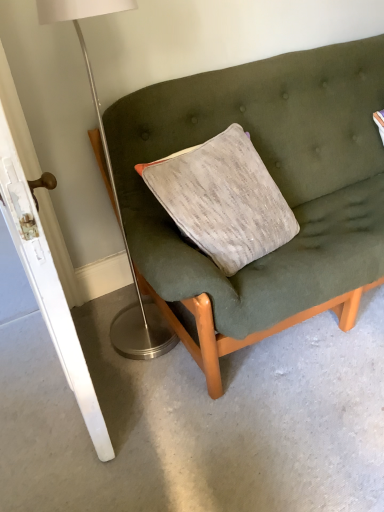
Question: From the image's perspective, is metallic silver floor lamp at left positioned above or below white glossy door at left?

Choices:
 (A) above
 (B) below

Answer: (A)

Question: In the image, is metallic silver floor lamp at left on the left side or the right side of white glossy door at left?

Choices:
 (A) left
 (B) right

Answer: (B)

Question: Which of these objects is positioned farthest from the textured fabric couch at center?

Choices:
 (A) metallic silver floor lamp at left
 (B) white glossy door at left

Answer: (B)

Question: Estimate the real-world distances between objects in this image. Which object is farther from the textured fabric couch at center?

Choices:
 (A) metallic silver floor lamp at left
 (B) white glossy door at left

Answer: (B)